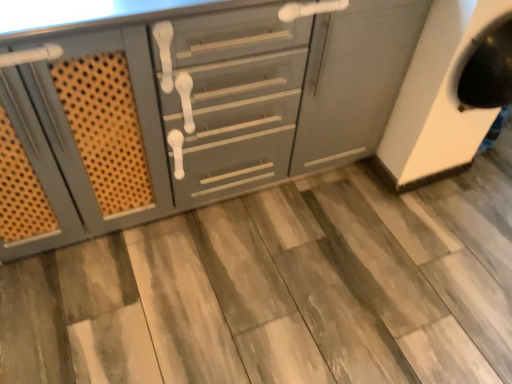
Question: Is wooden tile at center to the right of matte gray cabinet at center from the viewer's perspective?

Choices:
 (A) no
 (B) yes

Answer: (B)

Question: Is wooden tile at center closer to the viewer compared to matte gray cabinet at center?

Choices:
 (A) yes
 (B) no

Answer: (B)

Question: From a real-world perspective, is wooden tile at center physically above matte gray cabinet at center?

Choices:
 (A) yes
 (B) no

Answer: (B)

Question: Considering the relative sizes of wooden tile at center and matte gray cabinet at center in the image provided, is wooden tile at center thinner than matte gray cabinet at center?

Choices:
 (A) yes
 (B) no

Answer: (B)

Question: Could you tell me if wooden tile at center is turned towards matte gray cabinet at center?

Choices:
 (A) yes
 (B) no

Answer: (B)

Question: Can matte gray cabinet at center be found inside wooden tile at center?

Choices:
 (A) no
 (B) yes

Answer: (A)

Question: Is the depth of matte gray cabinet at center less than that of wooden tile at center?

Choices:
 (A) no
 (B) yes

Answer: (B)

Question: Is matte gray cabinet at center thinner than wooden tile at center?

Choices:
 (A) yes
 (B) no

Answer: (A)

Question: Is matte gray cabinet at center looking in the opposite direction of wooden tile at center?

Choices:
 (A) yes
 (B) no

Answer: (B)

Question: Is matte gray cabinet at center not within wooden tile at center?

Choices:
 (A) no
 (B) yes

Answer: (B)

Question: From the image's perspective, is matte gray cabinet at center above wooden tile at center?

Choices:
 (A) no
 (B) yes

Answer: (B)

Question: Considering the relative sizes of matte gray cabinet at center and wooden tile at center in the image provided, is matte gray cabinet at center smaller than wooden tile at center?

Choices:
 (A) no
 (B) yes

Answer: (A)

Question: In the image, is wooden tile at center on the left side or the right side of matte gray cabinet at center?

Choices:
 (A) right
 (B) left

Answer: (A)